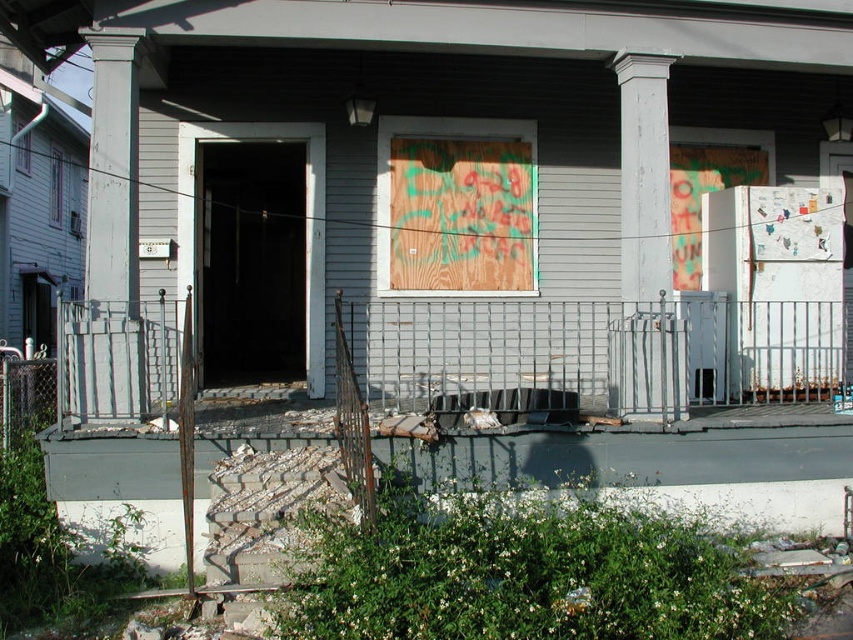
Is smooth gray column at left above white painted wood column at center?

Correct, smooth gray column at left is located above white painted wood column at center.

Does point (102, 195) come behind point (682, 337)?

That is False.

You are a GUI agent. You are given a task and a screenshot of the screen. Output one action in this format:
    pyautogui.click(x=<x>, y=<y>)
    Task: Click on the smooth gray column at left
    Image resolution: width=853 pixels, height=640 pixels.
    Given the screenshot: What is the action you would take?
    pyautogui.click(x=111, y=243)